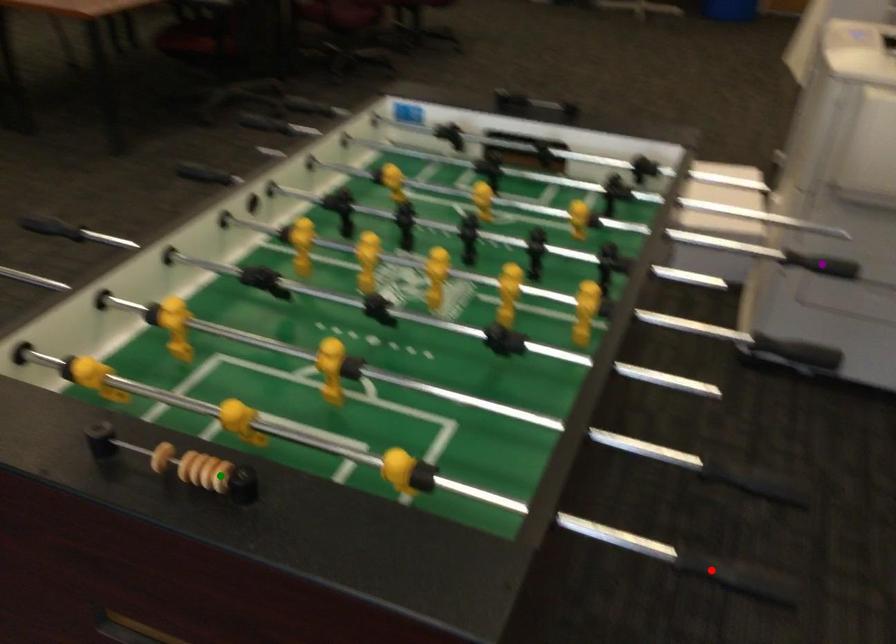
Order these from nearest to farthest:
- purple point
- green point
- red point

purple point, red point, green point